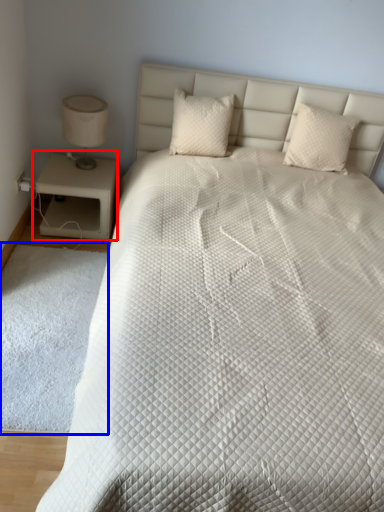
Question: Which of the following is the farthest to the observer, nightstand (highlighted by a red box) or mat (highlighted by a blue box)?

Choices:
 (A) nightstand
 (B) mat

Answer: (A)